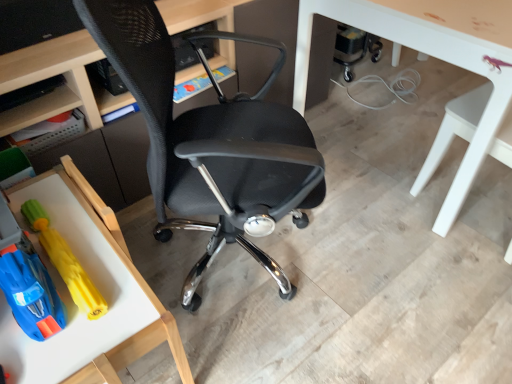
Where is `free space between white glossy table at right, which ranks as the first chair in right-to-left order, and black mesh chair at center, which appears as the 1th chair when viewed from the left`? free space between white glossy table at right, which ranks as the first chair in right-to-left order, and black mesh chair at center, which appears as the 1th chair when viewed from the left is located at coordinates pyautogui.click(x=384, y=246).